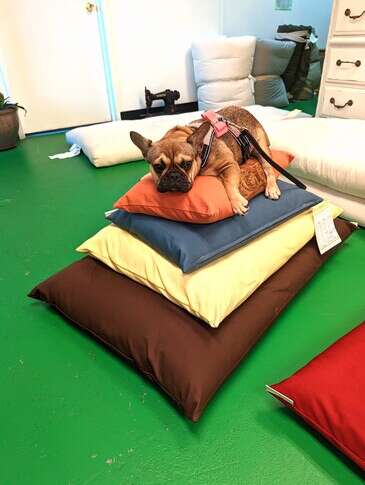
Identify the location of floor. (106, 440).